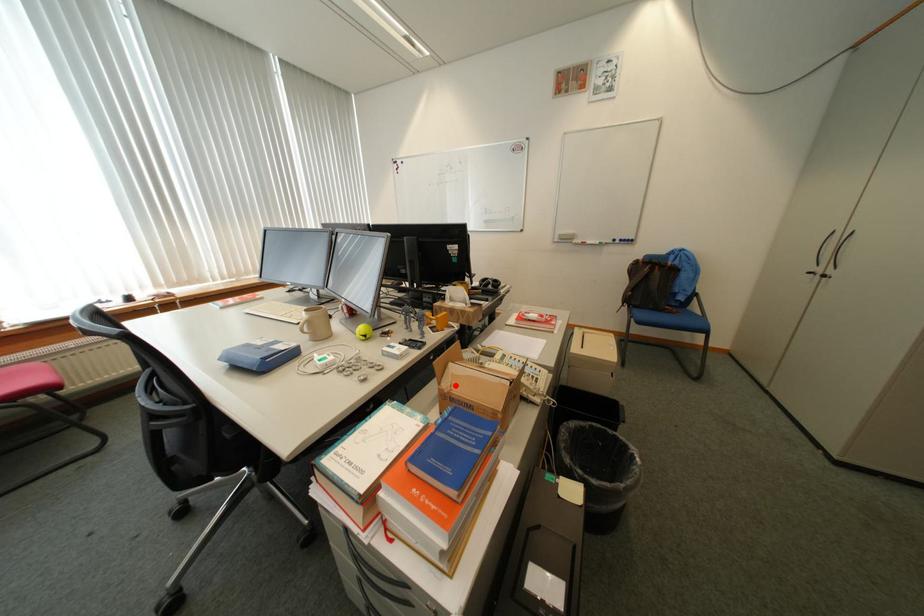
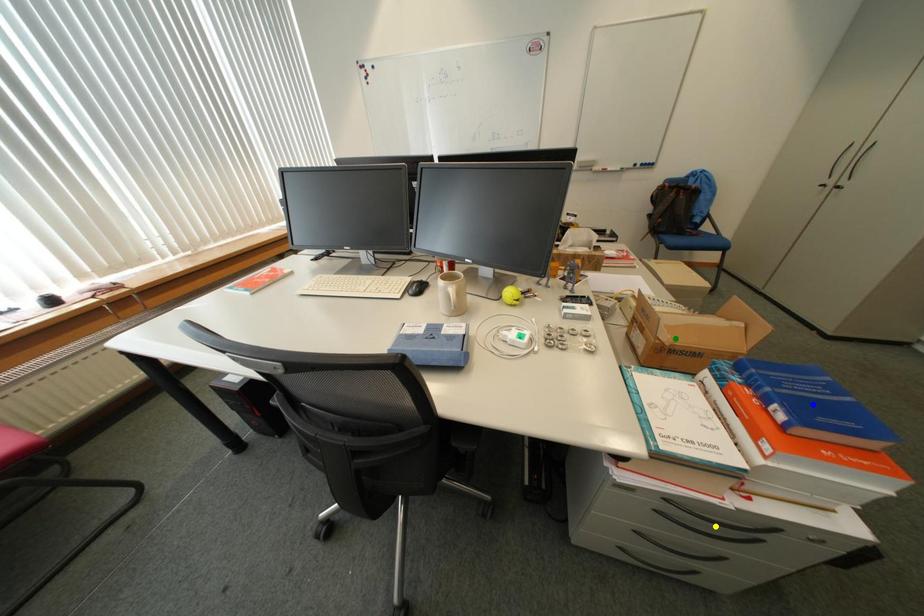
Question: I am providing you with two images of the same scene from different viewpoints. A red point is marked on the first image. You are given multiple points on the second image. Which mark in image 2 goes with the point in image 1?

Choices:
 (A) blue point
 (B) green point
 (C) yellow point

Answer: (B)